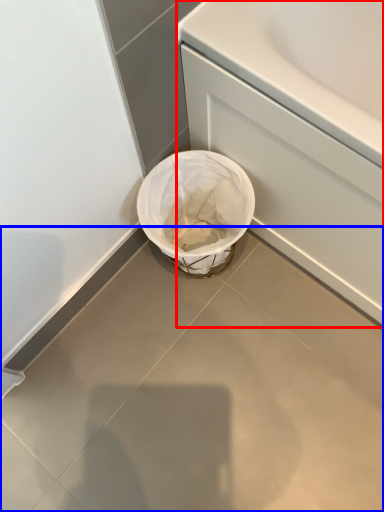
Question: Which of the following is the farthest to the observer, bath (highlighted by a red box) or concrete (highlighted by a blue box)?

Choices:
 (A) bath
 (B) concrete

Answer: (B)